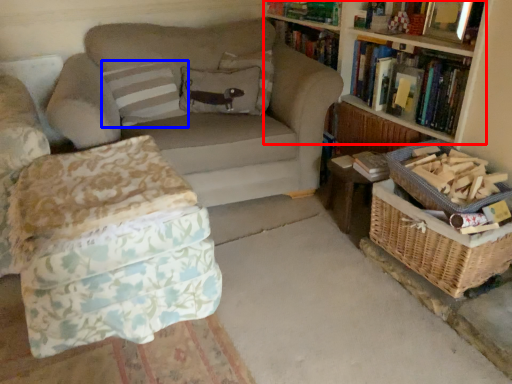
Question: Which point is further to the camera, bookcase (highlighted by a red box) or pillow (highlighted by a blue box)?

Choices:
 (A) bookcase
 (B) pillow

Answer: (B)